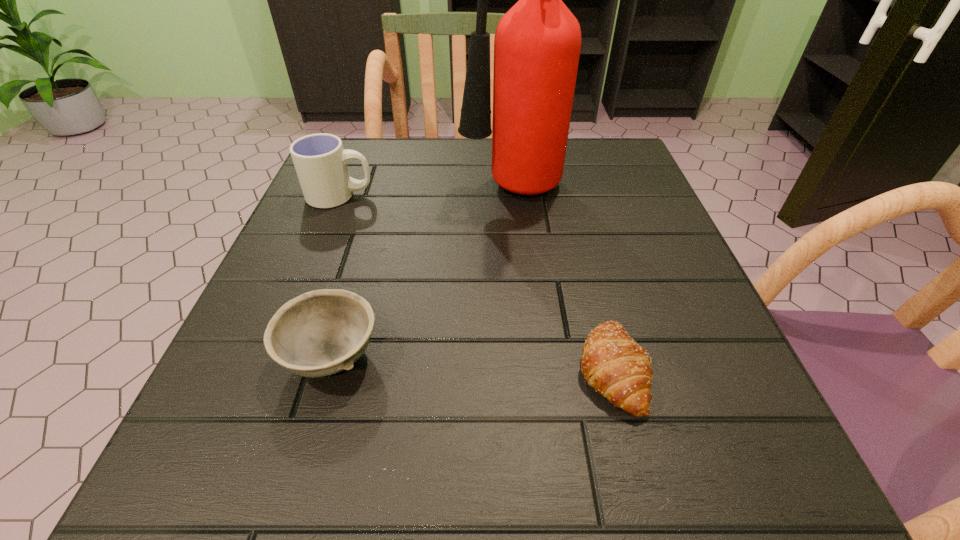
Locate an element on the screen. This screenshot has height=540, width=960. fire extinguisher located at the far edge is located at coordinates (537, 43).

Find the location of `cup positioned at the far edge`. cup positioned at the far edge is located at coordinates (320, 161).

In order to click on cup present at the left edge in this screenshot , I will do (320, 161).

Identify the location of bowl that is at the left edge. (319, 333).

Where is `object that is at the right edge`? object that is at the right edge is located at coordinates (613, 364).

Identify the location of object that is positioned at the far left corner. (320, 161).

Identify the location of free space at the far edge of the desktop. This screenshot has height=540, width=960. (548, 192).

I want to click on free spot at the near edge of the desktop, so click(x=310, y=511).

This screenshot has height=540, width=960. I want to click on vacant space at the left edge of the desktop, so click(252, 369).

Identify the location of vacant space at the right edge of the desktop. (712, 397).